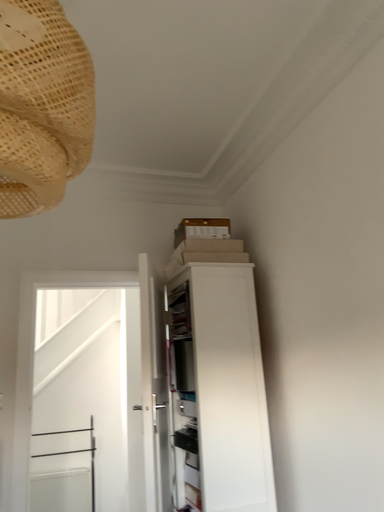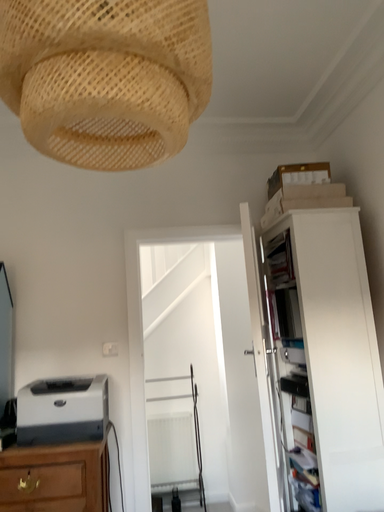
Question: How did the camera likely rotate when shooting the video?

Choices:
 (A) rotated left
 (B) rotated right

Answer: (A)